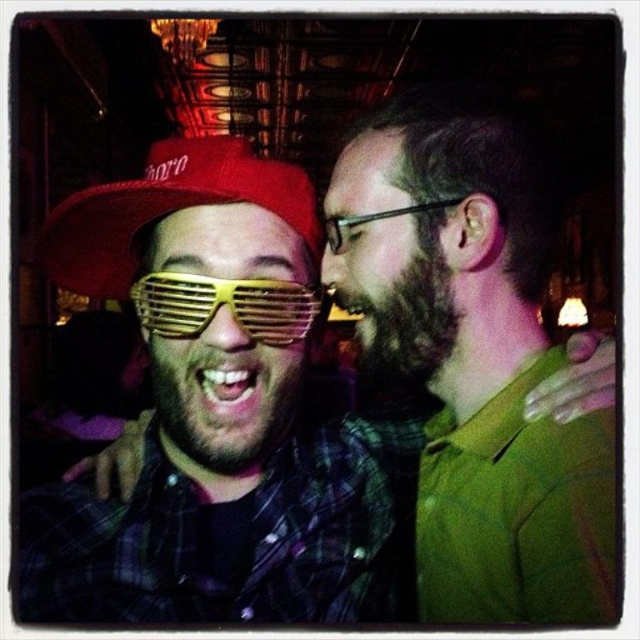
Describe the element at coordinates (224, 401) in the screenshot. This screenshot has width=640, height=640. I see `dark brown fuzzy beard at center` at that location.

Is dark brown fuzzy beard at center in front of dark brown fuzzy beard at right?

Yes.

Does point (186, 376) come closer to viewer compared to point (413, 291)?

Yes.

Image resolution: width=640 pixels, height=640 pixels. I want to click on dark brown fuzzy beard at center, so click(x=224, y=401).

Does matte yellow plastic sunglasses at center have a smaller size compared to matte red baseball cap at left?

Actually, matte yellow plastic sunglasses at center might be larger than matte red baseball cap at left.

Does matte yellow plastic sunglasses at center have a greater width compared to matte red baseball cap at left?

Yes.

I want to click on matte yellow plastic sunglasses at center, so click(x=480, y=353).

Who is more distant from viewer, (186, 458) or (237, 314)?

Point (186, 458)

This screenshot has width=640, height=640. Describe the element at coordinates (224, 401) in the screenshot. I see `dark brown fuzzy beard at center` at that location.

In order to click on dark brown fuzzy beard at center in this screenshot , I will do `click(224, 401)`.